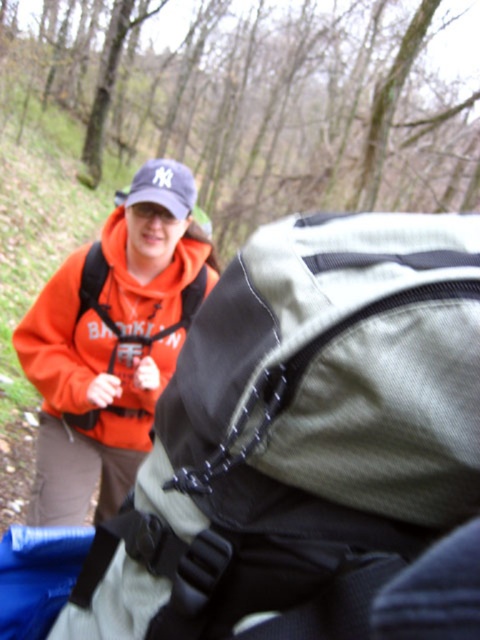
Is gray fabric backpack at center closer to camera compared to orange fleece jacket at center?

Yes, it is.

Can you confirm if gray fabric backpack at center is positioned to the left of orange fleece jacket at center?

No, gray fabric backpack at center is not to the left of orange fleece jacket at center.

What are the coordinates of `gray fabric backpack at center` in the screenshot? It's located at (300, 435).